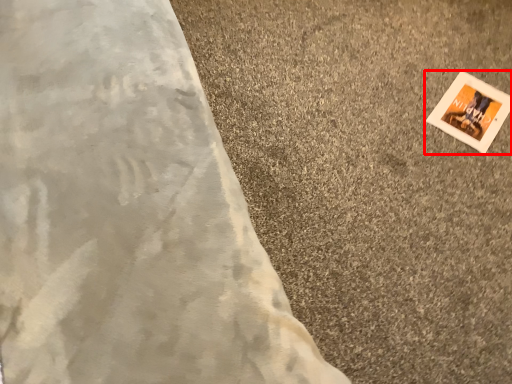
Question: From the image's perspective, what is the correct spatial relationship of picture frame (annotated by the red box) in relation to concrete?

Choices:
 (A) below
 (B) above

Answer: (B)